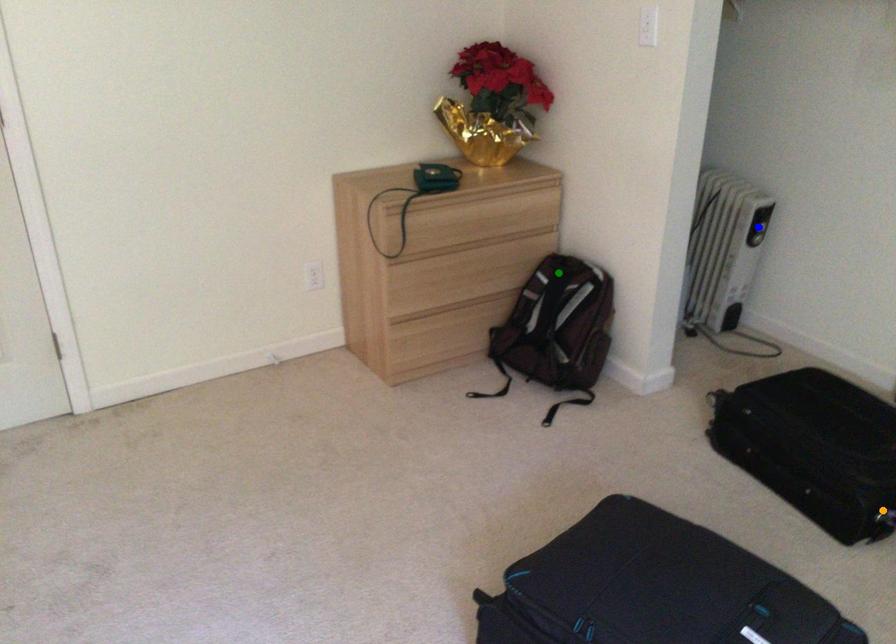
Order these from farthest to nearest:
- green point
- blue point
- orange point

blue point, green point, orange point